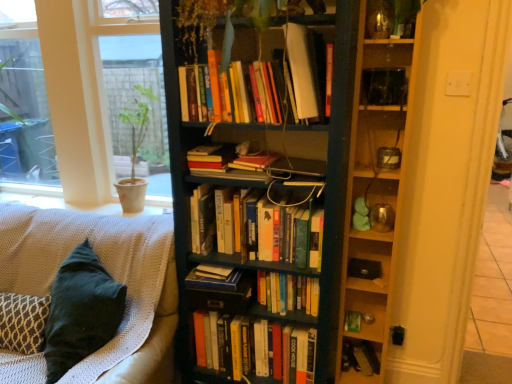
Question: Considering the relative sizes of matte beige pot at left and green matte paperback book at lower right in the image provided, is matte beige pot at left bigger than green matte paperback book at lower right?

Choices:
 (A) no
 (B) yes

Answer: (B)

Question: Considering the relative sizes of matte beige pot at left and green matte paperback book at lower right in the image provided, is matte beige pot at left wider than green matte paperback book at lower right?

Choices:
 (A) no
 (B) yes

Answer: (B)

Question: Can you confirm if matte beige pot at left is smaller than green matte paperback book at lower right?

Choices:
 (A) yes
 (B) no

Answer: (B)

Question: Is matte beige pot at left shorter than green matte paperback book at lower right?

Choices:
 (A) yes
 (B) no

Answer: (B)

Question: Is matte beige pot at left surrounding green matte paperback book at lower right?

Choices:
 (A) no
 (B) yes

Answer: (A)

Question: From the image's perspective, is hardcover book at center, acting as the third book starting from the top, located above or below hardcover books at center, which is the fourth book from top to bottom?

Choices:
 (A) above
 (B) below

Answer: (A)

Question: Is hardcover book at center, acting as the third book starting from the top, spatially inside hardcover books at center, arranged as the fifth book when ordered from the bottom, or outside of it?

Choices:
 (A) outside
 (B) inside

Answer: (A)

Question: Based on their sizes in the image, would you say hardcover book at center, the sixth book in the bottom-to-top sequence, is bigger or smaller than hardcover books at center, which is the fourth book from top to bottom?

Choices:
 (A) big
 (B) small

Answer: (B)

Question: From their relative heights in the image, would you say hardcover book at center, acting as the third book starting from the top, is taller or shorter than hardcover books at center, arranged as the fifth book when ordered from the bottom?

Choices:
 (A) tall
 (B) short

Answer: (B)

Question: From the image's perspective, relative to dark wood bookcase at center, is hardcover book at lower right, positioned as the 8th book in top-to-bottom order, above or below?

Choices:
 (A) above
 (B) below

Answer: (B)

Question: Does point (347, 367) appear closer or farther from the camera than point (283, 185)?

Choices:
 (A) closer
 (B) farther

Answer: (B)

Question: In terms of size, does hardcover book at lower right, which ranks as the 1th book in bottom-to-top order, appear bigger or smaller than dark wood bookcase at center?

Choices:
 (A) big
 (B) small

Answer: (B)

Question: From their relative heights in the image, would you say hardcover book at lower right, which ranks as the 1th book in bottom-to-top order, is taller or shorter than dark wood bookcase at center?

Choices:
 (A) tall
 (B) short

Answer: (B)

Question: In the image, is hardcover book at lower right, positioned as the 8th book in top-to-bottom order, positioned in front of or behind hardcover books at center, the 8th book ordered from the bottom?

Choices:
 (A) front
 (B) behind

Answer: (B)

Question: Based on their positions, is hardcover book at lower right, positioned as the 8th book in top-to-bottom order, located to the left or right of hardcover books at center, the 8th book ordered from the bottom?

Choices:
 (A) right
 (B) left

Answer: (A)